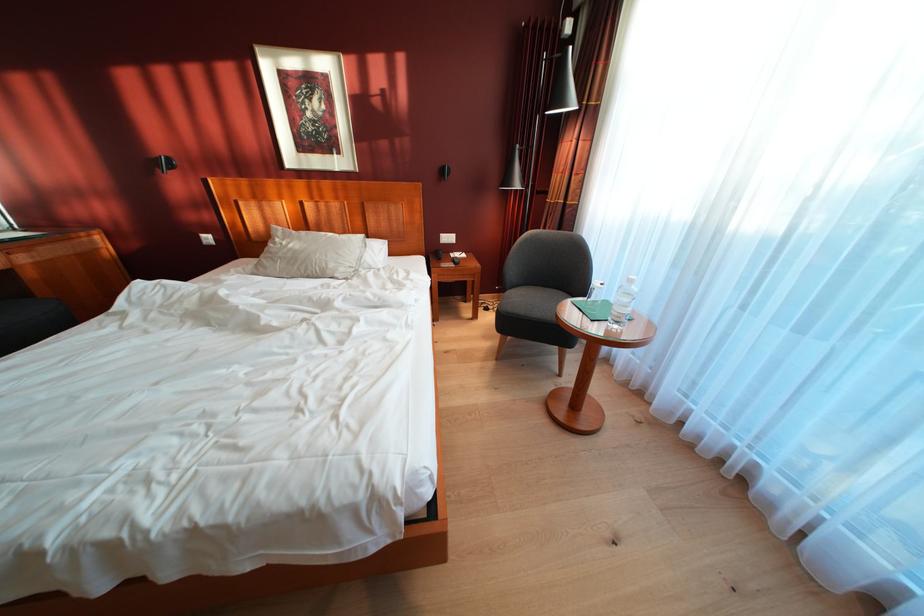
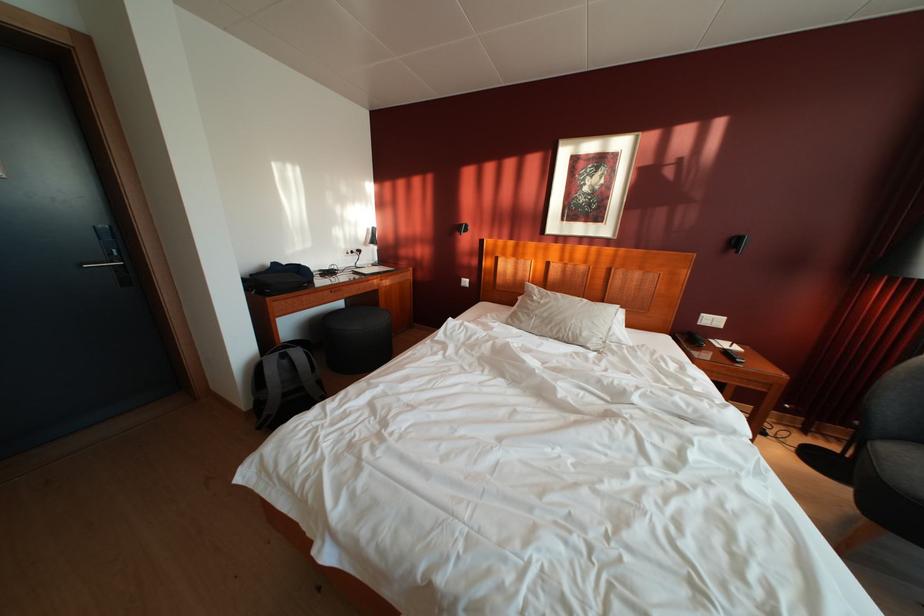
The point at [456,244] is marked in the first image. Where is the corresponding point in the second image?

(721, 326)